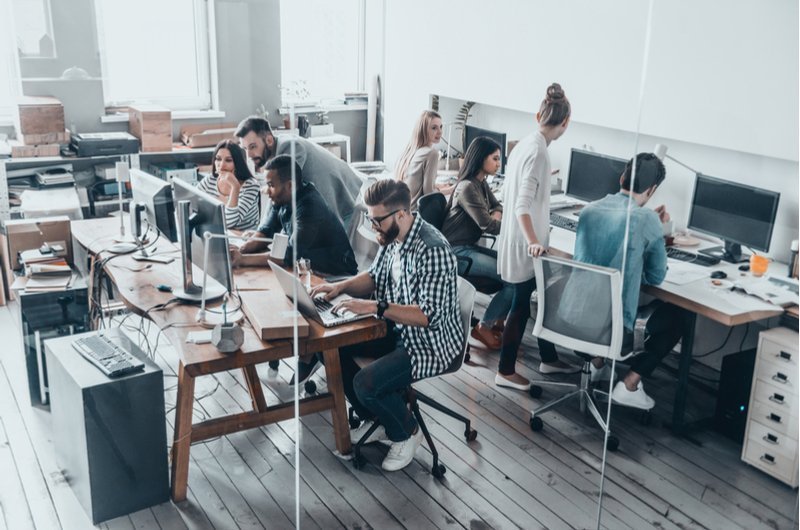
This screenshot has width=800, height=530. I want to click on chairs, so click(x=598, y=313), click(x=432, y=205), click(x=469, y=310), click(x=362, y=242).